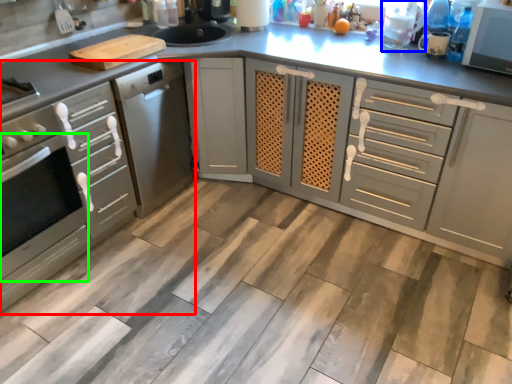
Question: Considering the real-world distances, which object is closest to cabinetry (highlighted by a red box)? appliance (highlighted by a blue box) or oven (highlighted by a green box).

Choices:
 (A) appliance
 (B) oven

Answer: (B)